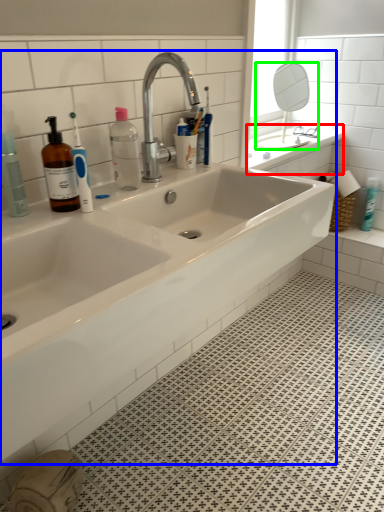
Question: Estimate the real-world distances between objects in this image. Which object is farther from counter top (highlighted by a red box), sink (highlighted by a blue box) or mirror (highlighted by a green box)?

Choices:
 (A) sink
 (B) mirror

Answer: (A)